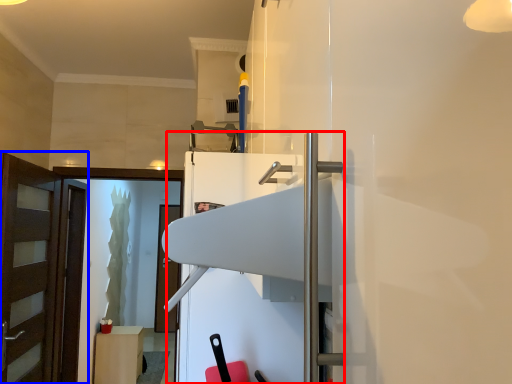
Question: Which point is closer to the camera, fridge (highlighted by a red box) or door (highlighted by a blue box)?

Choices:
 (A) fridge
 (B) door

Answer: (A)